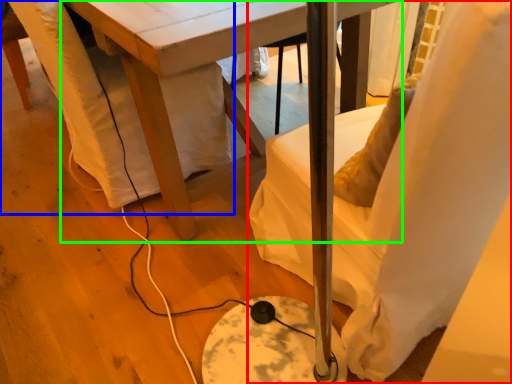
Question: Estimate the real-world distances between objects in this image. Which object is closer to chair (highlighted by a red box), swivel chair (highlighted by a blue box) or table (highlighted by a green box)?

Choices:
 (A) swivel chair
 (B) table

Answer: (B)